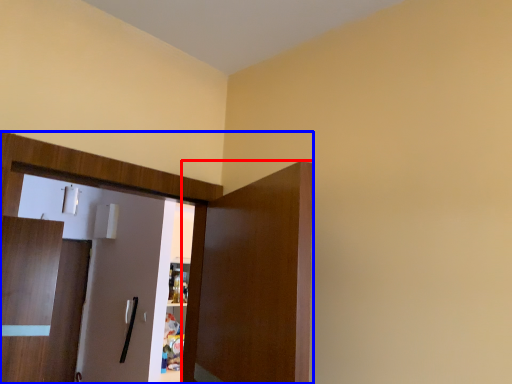
Question: Which object appears closest to the camera in this image, door (highlighted by a red box) or dresser (highlighted by a blue box)?

Choices:
 (A) door
 (B) dresser

Answer: (A)